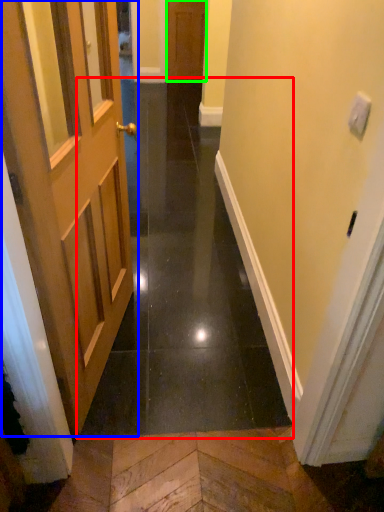
Question: Considering the real-world distances, which object is closest to path (highlighted by a red box)? door (highlighted by a blue box) or door (highlighted by a green box).

Choices:
 (A) door
 (B) door

Answer: (A)